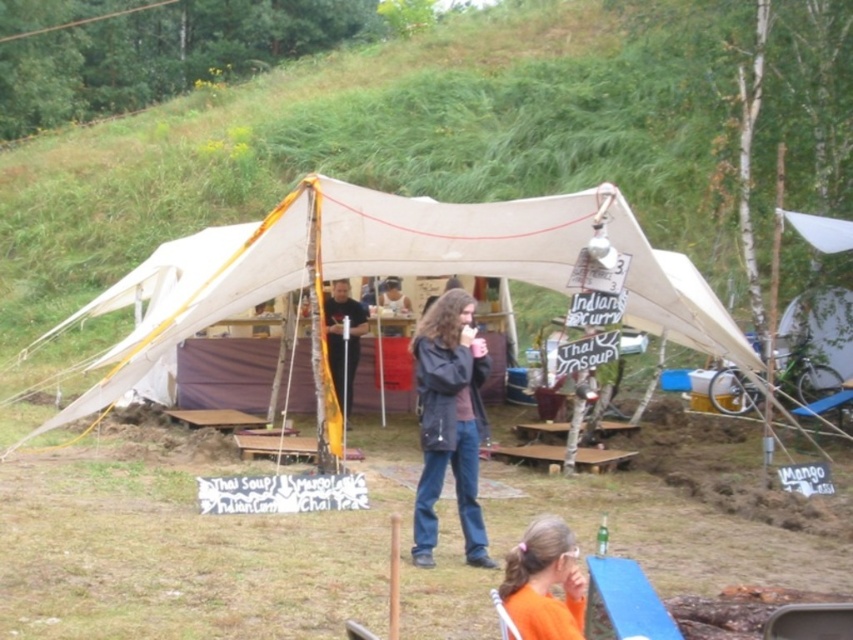
Who is positioned more to the left, dark gray jacket at center or orange fabric at lower center?

From the viewer's perspective, dark gray jacket at center appears more on the left side.

Who is more distant from viewer, (x=422, y=451) or (x=512, y=605)?

Positioned behind is point (x=422, y=451).

This screenshot has height=640, width=853. Find the location of `dark gray jacket at center`. dark gray jacket at center is located at coordinates (450, 420).

Measure the distance between orange fabric at lower center and camera.

orange fabric at lower center is 10.55 feet from camera.

Looking at this image, between orange fabric at lower center and matte black jacket at center, which one has more height?

matte black jacket at center

The width and height of the screenshot is (853, 640). What do you see at coordinates (544, 582) in the screenshot?
I see `orange fabric at lower center` at bounding box center [544, 582].

You are a GUI agent. You are given a task and a screenshot of the screen. Output one action in this format:
    pyautogui.click(x=<x>, y=<y>)
    Task: Click on the orange fabric at lower center
    
    Given the screenshot: What is the action you would take?
    pyautogui.click(x=544, y=582)

Who is shorter, beige canvas tent at center or matte black jacket at center?

matte black jacket at center is shorter.

Does beige canvas tent at center have a larger size compared to matte black jacket at center?

Indeed, beige canvas tent at center has a larger size compared to matte black jacket at center.

Is point (735, 360) closer to viewer compared to point (355, 328)?

Yes, point (735, 360) is in front of point (355, 328).

I want to click on beige canvas tent at center, so click(422, 268).